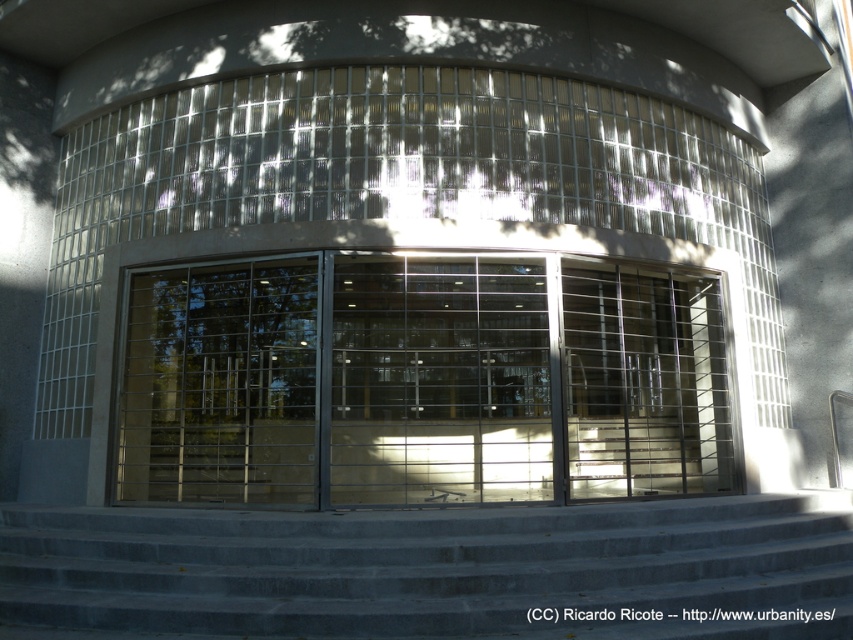
You are a delivery person approaching the entrance of the modern building. You need to deliver a package to the office located behind the transparent glass door at center. The gray concrete stairs at lower center might block your path. Can you reach the door without climbing the stairs?

The gray concrete stairs at lower center is below the transparent glass door at center, so you can reach the transparent glass door at center without needing to climb the stairs as it is positioned above the stairs.

You are a delivery person carrying a large package and need to enter the building. The clear glass door at center is the main entrance. However, you notice the gray concrete stairs at lower center leading to a side entrance. Which entrance should you use to deliver the package to the first floor?

The clear glass door at center is above the gray concrete stairs at lower center, so to reach the first floor, you should use the clear glass door at center as it is directly on the first floor level. The stairs lead to a lower level, so they might not be the correct entrance for the first floor delivery.

You are a delivery person approaching the entrance of the modern building. You see two doors in front of you, the clear glass door at center and the transparent glass door at center. Which door should you go through first?

You should go through the clear glass door at center first because it is in front of the transparent glass door at center, meaning it is closer to you.